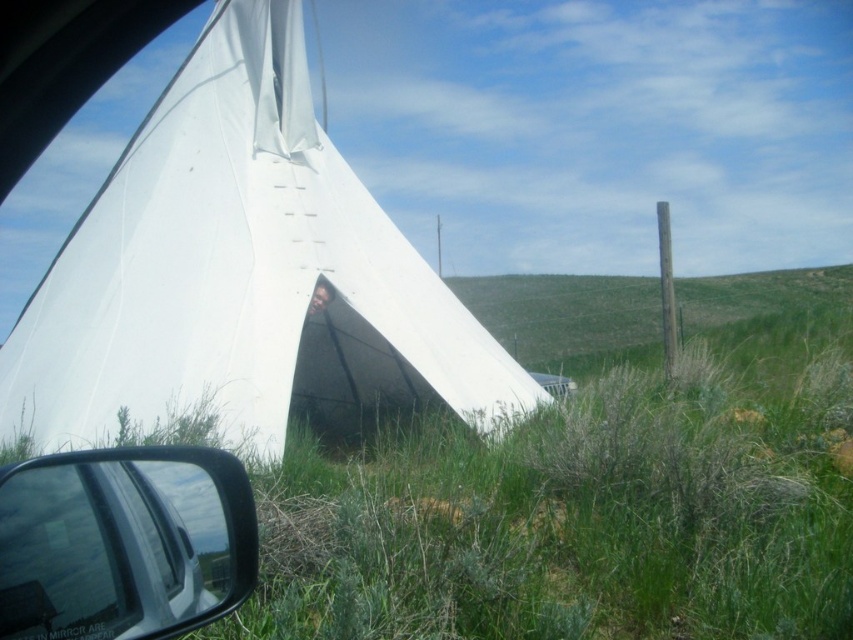
You are inside a car and looking at the white canvas tent at center through the side mirror. There is a point marked at coordinates (242,276). Can you tell me where this point is located?

The point (242,276) is located on the white canvas tent at center, as described in the scene.

You are driving a car and want to check if the white canvas tent at center is visible in the black plastic side mirror at lower left. Based on their positions, can you see the tent in the mirror?

The white canvas tent at center is located above the black plastic side mirror at lower left, so it might not be visible in the mirror since it is positioned higher than the mirror.

You are inside a car and looking at the white teepee tent through the side mirror. There are two points marked on the mirror reflection. The first point is at coordinates point (173, 166) and the second point is at point (219, 512). Which point is closer to you in the reflection?

Point (173, 166) is further to the viewer than point (219, 512), so the point closer to you in the reflection is point (219, 512).